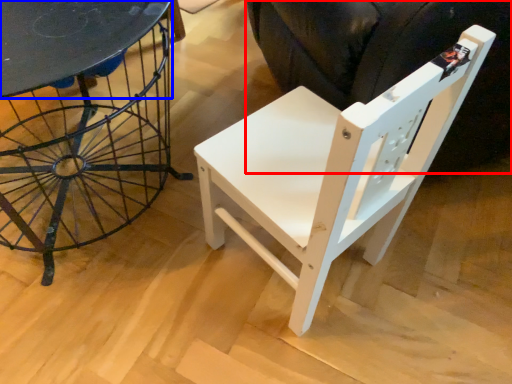
Question: Which object appears closest to the camera in this image, swivel chair (highlighted by a red box) or round table (highlighted by a blue box)?

Choices:
 (A) swivel chair
 (B) round table

Answer: (A)